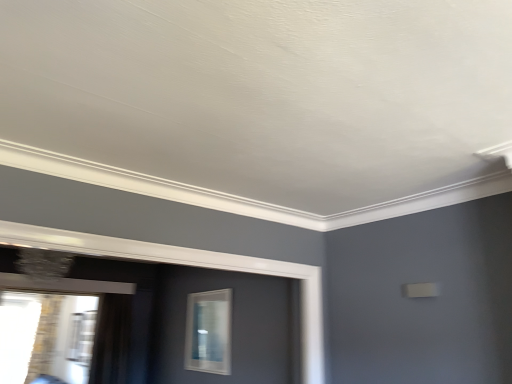
Question: Is clear glass window at center, the 2th window from the left, outside black sheer curtain at left?

Choices:
 (A) no
 (B) yes

Answer: (B)

Question: Could you tell me if clear glass window at center, the 2th window from the left, is turned towards black sheer curtain at left?

Choices:
 (A) no
 (B) yes

Answer: (A)

Question: Is clear glass window at center, the 2th window from the left, further to the viewer compared to black sheer curtain at left?

Choices:
 (A) no
 (B) yes

Answer: (A)

Question: Considering the relative sizes of clear glass window at center, which appears as the 1th window when viewed from the right, and black sheer curtain at left in the image provided, is clear glass window at center, which appears as the 1th window when viewed from the right, thinner than black sheer curtain at left?

Choices:
 (A) no
 (B) yes

Answer: (B)

Question: From the image's perspective, is clear glass window at center, the 2th window from the left, beneath black sheer curtain at left?

Choices:
 (A) no
 (B) yes

Answer: (A)

Question: Is the position of clear glass window at center, which appears as the 1th window when viewed from the right, less distant than that of black sheer curtain at left?

Choices:
 (A) no
 (B) yes

Answer: (B)

Question: From a real-world perspective, does clear glass window at center, which appears as the 1th window when viewed from the right, sit lower than transparent glass window at lower left, which appears as the 2th window when viewed from the right?

Choices:
 (A) no
 (B) yes

Answer: (A)

Question: Considering the relative sizes of clear glass window at center, which appears as the 1th window when viewed from the right, and transparent glass window at lower left, which appears as the 2th window when viewed from the right, in the image provided, is clear glass window at center, which appears as the 1th window when viewed from the right, bigger than transparent glass window at lower left, which appears as the 2th window when viewed from the right,?

Choices:
 (A) yes
 (B) no

Answer: (B)

Question: Does clear glass window at center, the 2th window from the left, have a greater height compared to transparent glass window at lower left, which appears as the 2th window when viewed from the right?

Choices:
 (A) no
 (B) yes

Answer: (A)

Question: Does clear glass window at center, the 2th window from the left, appear on the right side of transparent glass window at lower left, which is the first window in left-to-right order?

Choices:
 (A) no
 (B) yes

Answer: (B)

Question: Is transparent glass window at lower left, which is the first window in left-to-right order, at the back of clear glass window at center, which appears as the 1th window when viewed from the right?

Choices:
 (A) no
 (B) yes

Answer: (A)

Question: Does clear glass window at center, which appears as the 1th window when viewed from the right, have a lesser height compared to transparent glass window at lower left, which is the first window in left-to-right order?

Choices:
 (A) yes
 (B) no

Answer: (A)

Question: From a real-world perspective, is transparent glass window at lower left, which appears as the 2th window when viewed from the right, located higher than clear glass window at center, the 2th window from the left?

Choices:
 (A) no
 (B) yes

Answer: (A)